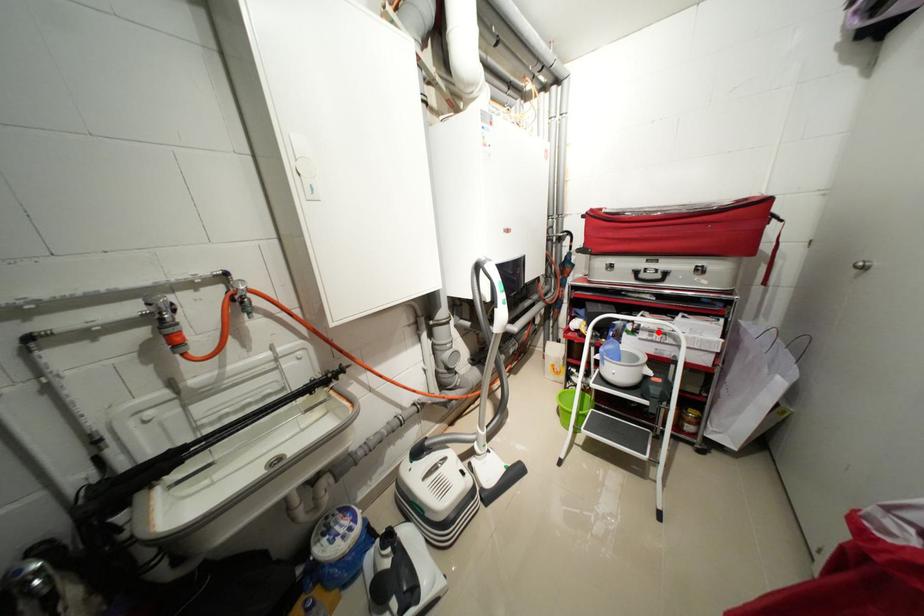
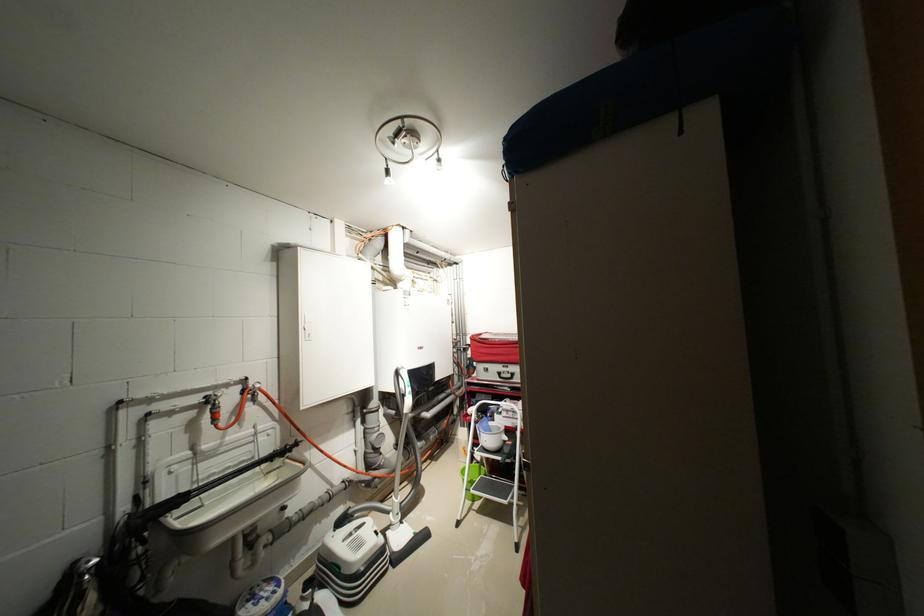
Question: I am providing you with two images of the same scene from different viewpoints. Given a red point in image1, look at the same physical point in image2. Is it:

Choices:
 (A) Closer to the viewpoint
 (B) Farther from the viewpoint

Answer: (B)